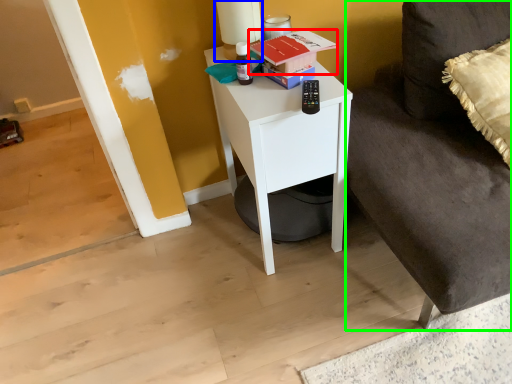
Question: Based on their relative distances, which object is nearer to book (highlighted by a red box)? Choose from table lamp (highlighted by a blue box) and couch (highlighted by a green box).

Choices:
 (A) table lamp
 (B) couch

Answer: (A)